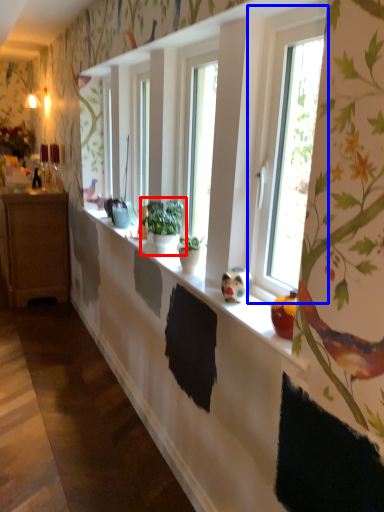
Question: Which object appears closest to the camera in this image, houseplant (highlighted by a red box) or window (highlighted by a blue box)?

Choices:
 (A) houseplant
 (B) window

Answer: (B)